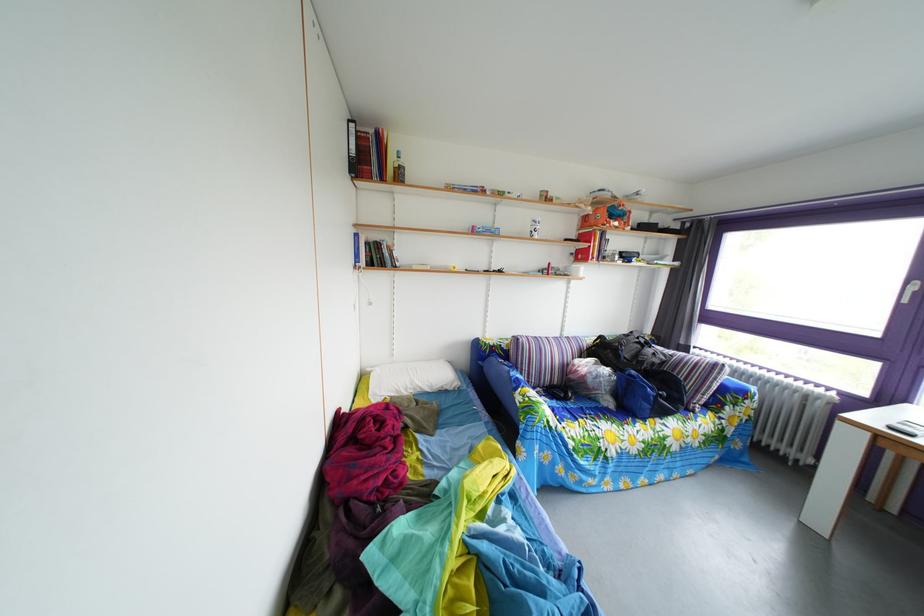
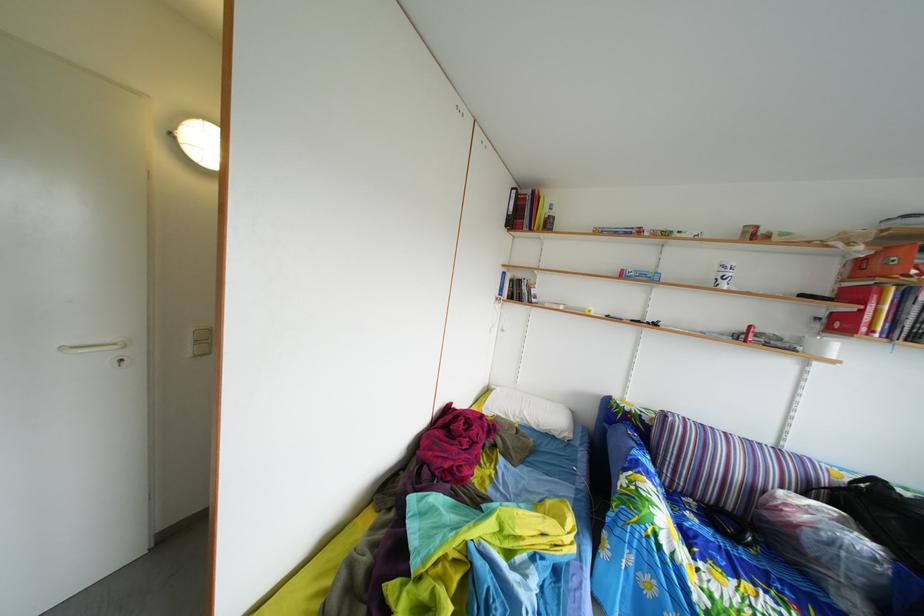
Question: The camera is either moving clockwise (left) or counter-clockwise (right) around the object. The first image is from the beginning of the video and the second image is from the end. Is the camera moving left or right when shooting the video?

Choices:
 (A) Left
 (B) Right

Answer: (B)